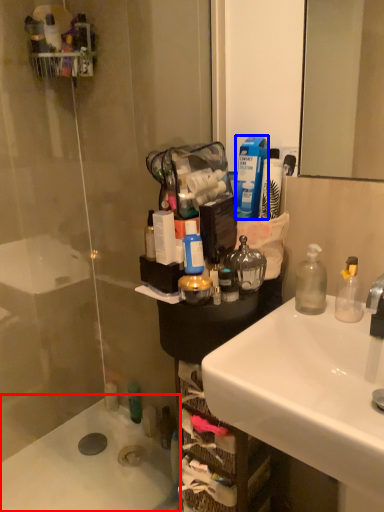
Question: Which point is closer to the camera, bath (highlighted by a red box) or mouthwash (highlighted by a blue box)?

Choices:
 (A) bath
 (B) mouthwash

Answer: (B)